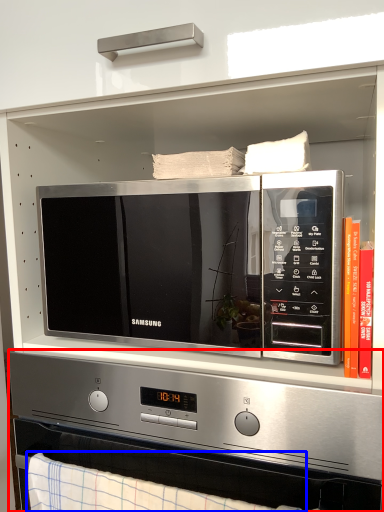
Question: Which object is further to the camera taking this photo, appliance (highlighted by a red box) or blanket (highlighted by a blue box)?

Choices:
 (A) appliance
 (B) blanket

Answer: (A)